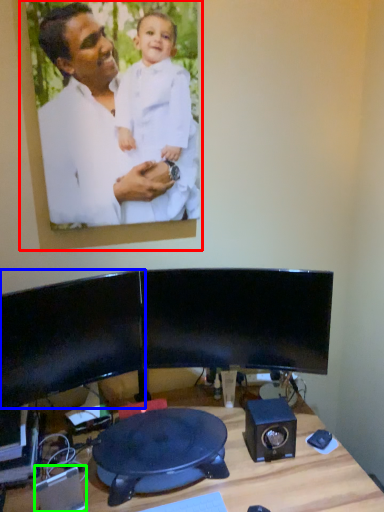
Question: Considering the real-world distances, which object is farthest from picture frame (highlighted by a red box)? computer monitor (highlighted by a blue box) or speaker (highlighted by a green box)?

Choices:
 (A) computer monitor
 (B) speaker

Answer: (B)